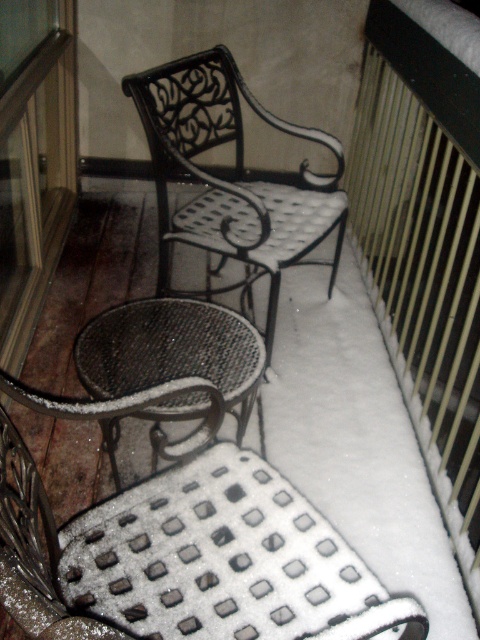
Which is behind, point (123, 396) or point (108, 365)?

The point (108, 365) is behind.

Is metallic mesh chair at lower center above metallic mesh table at center?

Actually, metallic mesh chair at lower center is below metallic mesh table at center.

Where is `metallic mesh chair at lower center`? metallic mesh chair at lower center is located at coordinates [x=213, y=545].

Who is more forward, (276, 500) or (240, 88)?

Point (276, 500) is more forward.

Is point (47, 412) farther from camera compared to point (336, 156)?

No.

Locate an element on the screen. This screenshot has height=640, width=480. metallic mesh chair at lower center is located at coordinates (213, 545).

Does black wrought iron chair at center appear over metallic mesh table at center?

Correct, black wrought iron chair at center is located above metallic mesh table at center.

Does black wrought iron chair at center appear under metallic mesh table at center?

No.

You are a GUI agent. You are given a task and a screenshot of the screen. Output one action in this format:
    pyautogui.click(x=<x>, y=<y>)
    Task: Click on the black wrought iron chair at center
    The height and width of the screenshot is (640, 480).
    Given the screenshot: What is the action you would take?
    tap(232, 177)